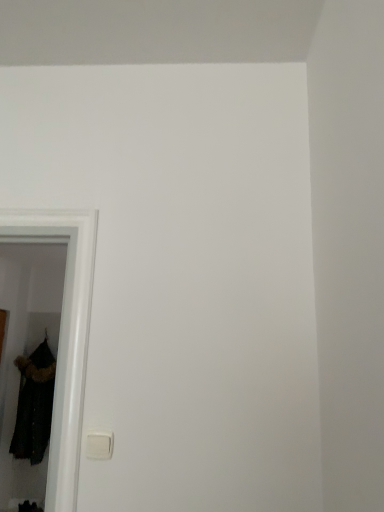
Question: Is velvet black coat at left facing away from white plastic light switch at lower left?

Choices:
 (A) yes
 (B) no

Answer: (B)

Question: Is velvet black coat at left positioned behind white plastic light switch at lower left?

Choices:
 (A) no
 (B) yes

Answer: (B)

Question: Is the position of velvet black coat at left less distant than that of white plastic light switch at lower left?

Choices:
 (A) yes
 (B) no

Answer: (B)

Question: Can you confirm if velvet black coat at left is bigger than white plastic light switch at lower left?

Choices:
 (A) yes
 (B) no

Answer: (A)

Question: Is velvet black coat at left thinner than white plastic light switch at lower left?

Choices:
 (A) no
 (B) yes

Answer: (A)

Question: Is velvet black coat at left wider than white plastic light switch at lower left?

Choices:
 (A) yes
 (B) no

Answer: (A)

Question: Is white plastic light switch at lower left far away from velvet black coat at left?

Choices:
 (A) yes
 (B) no

Answer: (A)

Question: Is velvet black coat at left located within white plastic light switch at lower left?

Choices:
 (A) yes
 (B) no

Answer: (B)

Question: Considering the relative sizes of white plastic light switch at lower left and velvet black coat at left in the image provided, is white plastic light switch at lower left taller than velvet black coat at left?

Choices:
 (A) yes
 (B) no

Answer: (B)

Question: Is white plastic light switch at lower left outside velvet black coat at left?

Choices:
 (A) no
 (B) yes

Answer: (B)

Question: From the image's perspective, does white plastic light switch at lower left appear higher than velvet black coat at left?

Choices:
 (A) no
 (B) yes

Answer: (B)

Question: Is white plastic light switch at lower left bigger than velvet black coat at left?

Choices:
 (A) no
 (B) yes

Answer: (A)

Question: From the image's perspective, is velvet black coat at left above or below white plastic light switch at lower left?

Choices:
 (A) above
 (B) below

Answer: (B)